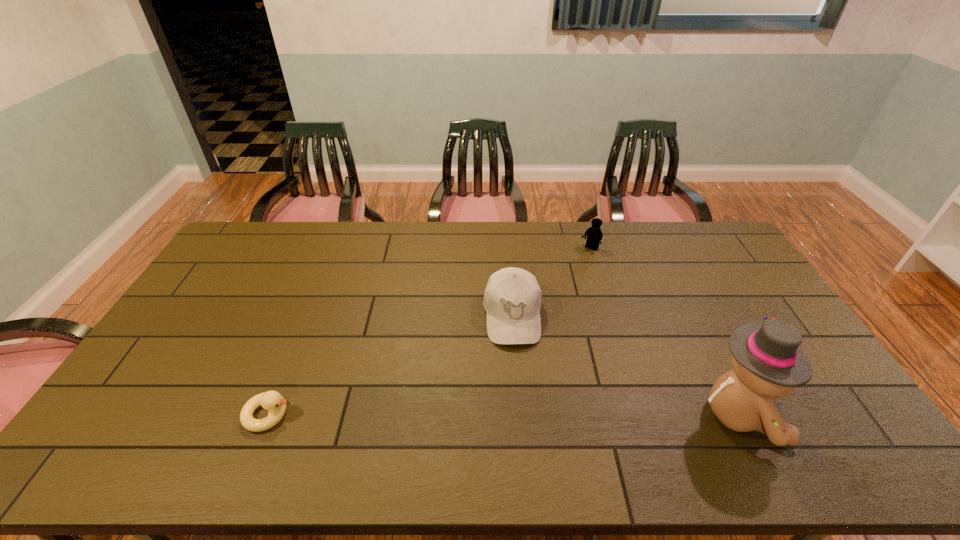
At what (x,y) coordinates should I click in order to perform the action: click on vacant space located on the front-facing side of the third object from right to left. Please return your answer as a coordinate pair (x, y). Looking at the image, I should click on click(x=517, y=377).

You are a GUI agent. You are given a task and a screenshot of the screen. Output one action in this format:
    pyautogui.click(x=<x>, y=<y>)
    Task: Click on the vacant area situated 0.120m on the front-facing side of the third object from right to left
    
    Given the screenshot: What is the action you would take?
    517,383

The image size is (960, 540). Identify the location of blank space located 0.240m on the front-facing side of the third object from right to left. (521, 423).

This screenshot has width=960, height=540. I want to click on vacant space located 0.070m on the front-facing side of the Lego, so click(x=578, y=263).

You are a GUI agent. You are given a task and a screenshot of the screen. Output one action in this format:
    pyautogui.click(x=<x>, y=<y>)
    Task: Click on the free space located 0.320m on the front-facing side of the Lego
    
    Given the screenshot: What is the action you would take?
    pyautogui.click(x=546, y=303)

Image resolution: width=960 pixels, height=540 pixels. Find the location of `free space located on the front-facing side of the Lego`. free space located on the front-facing side of the Lego is located at coordinates (556, 291).

The width and height of the screenshot is (960, 540). I want to click on object at the far edge, so click(594, 234).

Identify the location of duckling that is at the near edge. (272, 401).

The width and height of the screenshot is (960, 540). I want to click on rag_doll located in the near edge section of the desktop, so click(x=768, y=362).

Locate an element on the screen. vacant space at the far edge is located at coordinates 534,255.